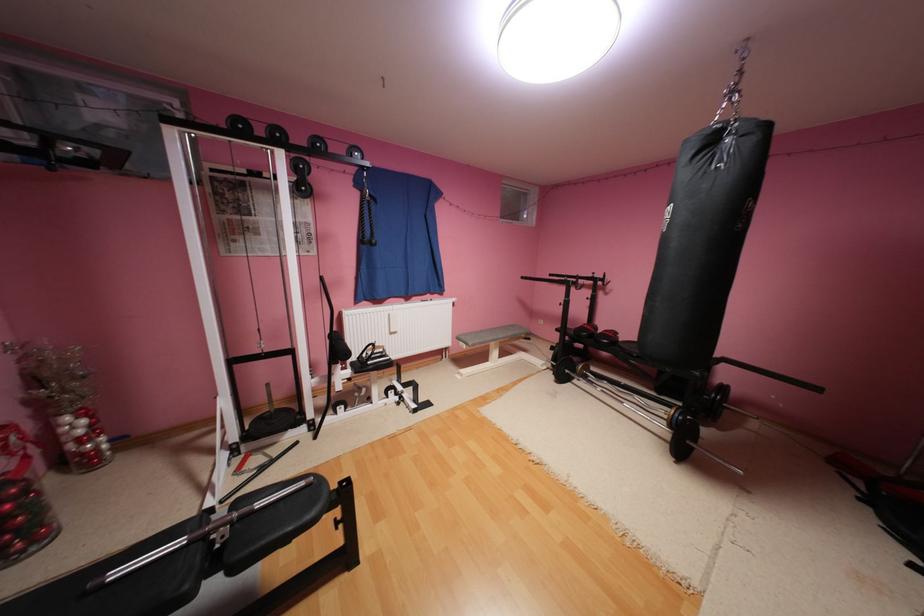
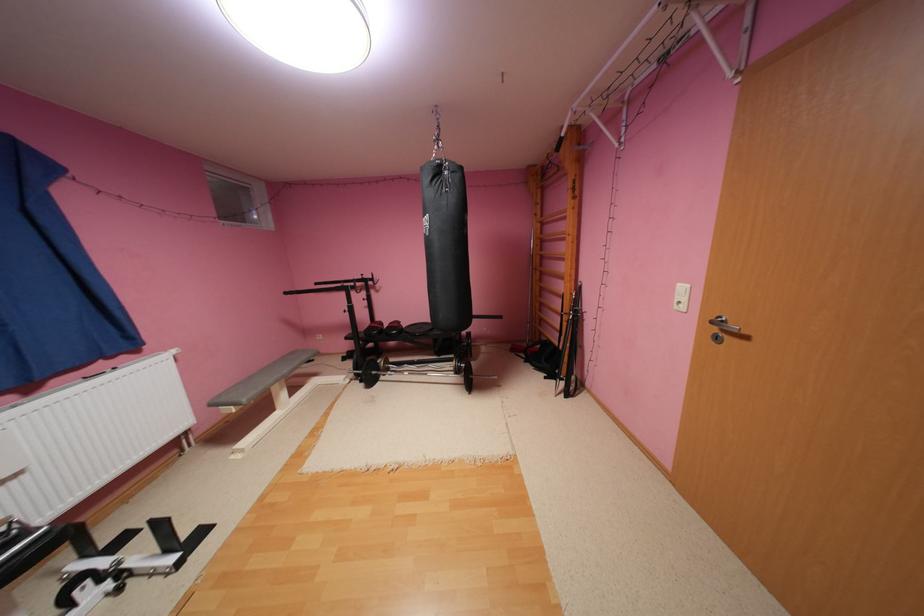
Where in the second image is the point corresponding to pixel 592 378 from the first image?

(396, 371)